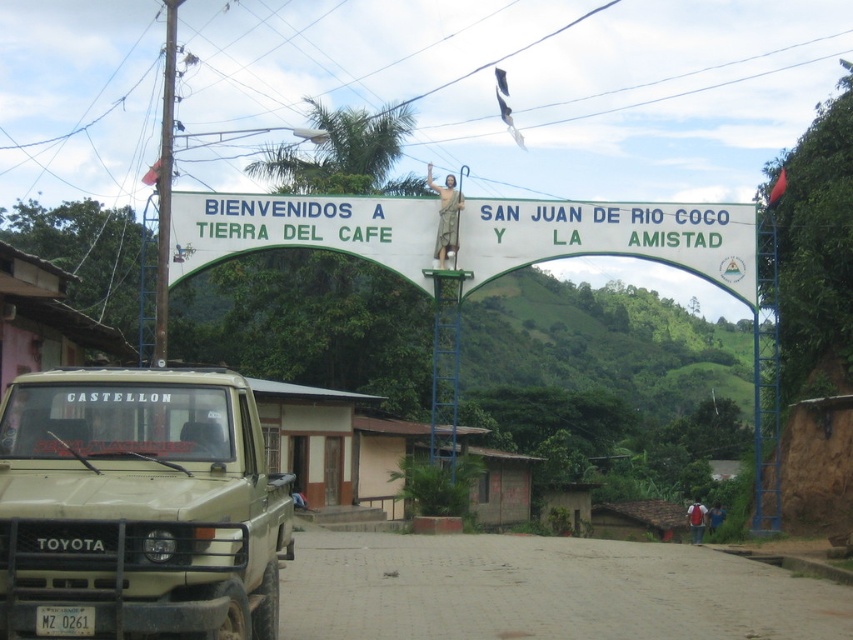
You are a visitor arriving at San Juan de Rio Coco and see the beige matte truck at lower left and the white painted wood sign at center. Which object is positioned more to the east if the archway faces north?

The beige matte truck at lower left is positioned more to the east since it is to the left of the white painted wood sign at center, and if the archway faces north, left would correspond to the east direction.

You are a tourist arriving at San Juan de Rio Coco and see the beige matte truck at lower left and the white painted wood sign at center. Which object is closer to the entrance of the town?

The beige matte truck at lower left is positioned under the white painted wood sign at center, so the truck is closer to the entrance of the town.